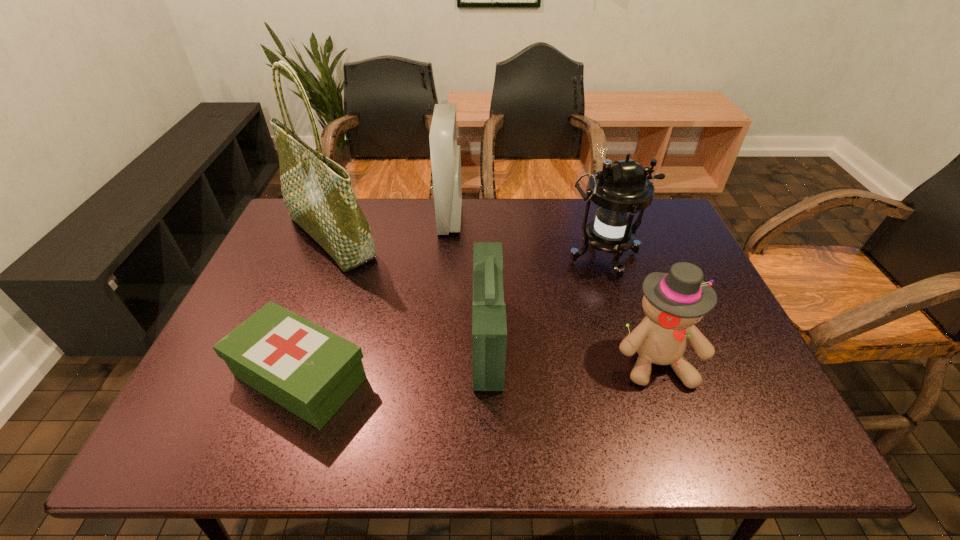
What are the coordinates of `vacant space at the left edge of the desktop` in the screenshot? It's located at (316, 266).

Locate an element on the screen. vacant point at the right edge is located at coordinates (714, 324).

Identify the location of free spot at the near left corner of the desktop. (204, 423).

Find the location of a particular element. Image resolution: width=960 pixels, height=540 pixels. blank region between the shortest object and the fifth tallest object is located at coordinates (394, 359).

This screenshot has width=960, height=540. I want to click on free space between the lantern and the fourth object from left to right, so click(x=545, y=299).

Identify the location of empty space between the rag_doll and the second shortest object. (572, 350).

You are a GUI agent. You are given a task and a screenshot of the screen. Output one action in this format:
    pyautogui.click(x=<x>, y=<y>)
    Task: Click on the free space between the shopping bag and the lantern
    
    Given the screenshot: What is the action you would take?
    pyautogui.click(x=468, y=247)

Identify the location of blank region between the shopping bag and the shortest object. The height and width of the screenshot is (540, 960). (316, 307).

Find the location of a particular element. The height and width of the screenshot is (540, 960). empty location between the second tallest first-aid kit and the rag_doll is located at coordinates (572, 350).

Identify the location of free space between the tallest object and the rightmost first-aid kit. This screenshot has height=540, width=960. (410, 289).